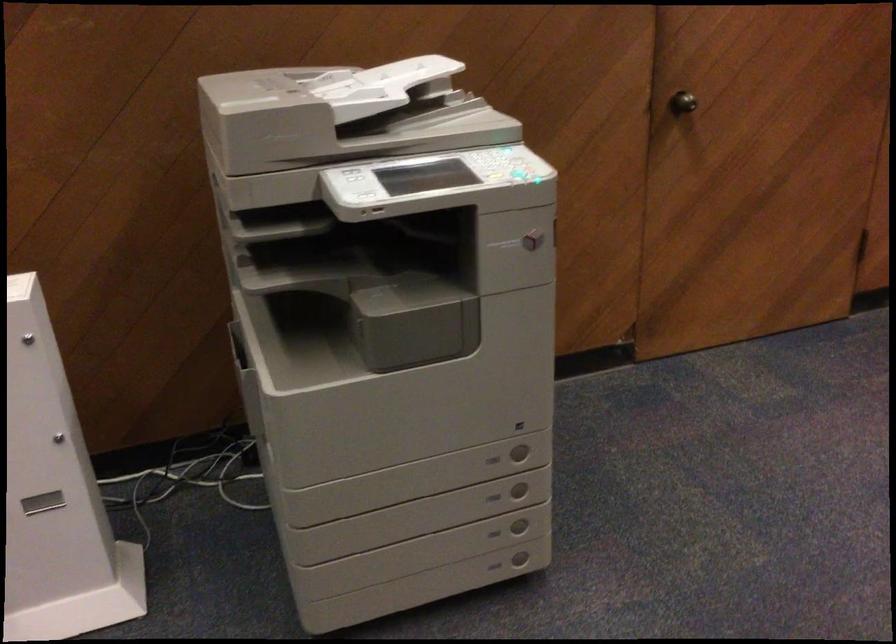
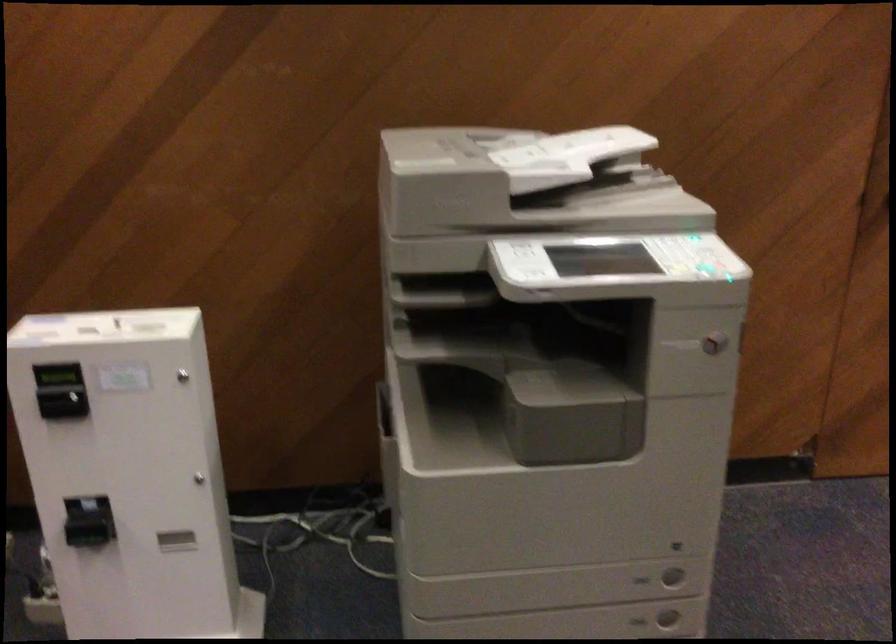
Find the pixel in the second image that matches (410,73) in the first image.

(600, 143)